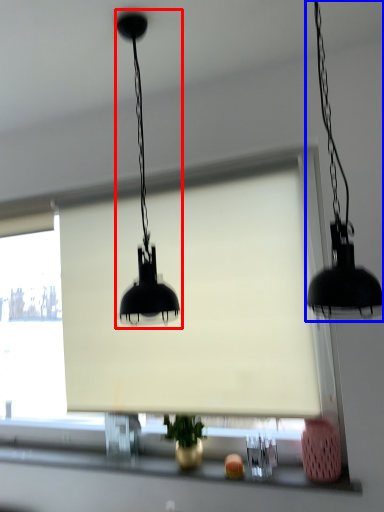
Question: Which point is further to the camera, lamp (highlighted by a red box) or lamp (highlighted by a blue box)?

Choices:
 (A) lamp
 (B) lamp

Answer: (A)